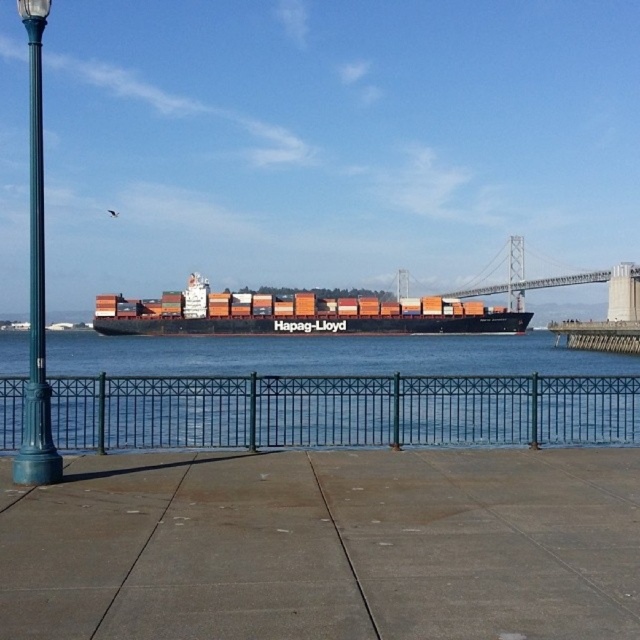
Question: Which object is the farthest from the concrete at center?

Choices:
 (A) teal painted metal pole at left
 (B) green metal fence at center
 (C) orange matte container ship at center

Answer: (C)

Question: Observing the image, what is the correct spatial positioning of orange matte container ship at center in reference to teal painted metal pole at left?

Choices:
 (A) left
 (B) right

Answer: (B)

Question: Does concrete at center lie behind orange matte container ship at center?

Choices:
 (A) yes
 (B) no

Answer: (B)

Question: Which point is closer to the camera?

Choices:
 (A) teal painted metal pole at left
 (B) green metal fence at center

Answer: (A)

Question: Which of these objects is positioned farthest from the orange matte container ship at center?

Choices:
 (A) green metal fence at center
 (B) teal painted metal pole at left
 (C) concrete at center

Answer: (A)

Question: Is concrete at center positioned before green metal fence at center?

Choices:
 (A) no
 (B) yes

Answer: (B)